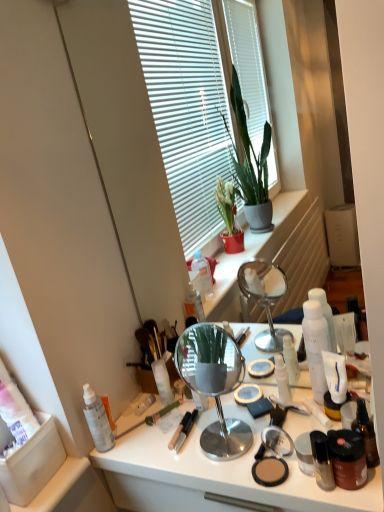
Where is `vacant area that lies in front of white plastic container at center, the 6th toiletry when ordered from right to left`? The height and width of the screenshot is (512, 384). vacant area that lies in front of white plastic container at center, the 6th toiletry when ordered from right to left is located at coordinates (174, 441).